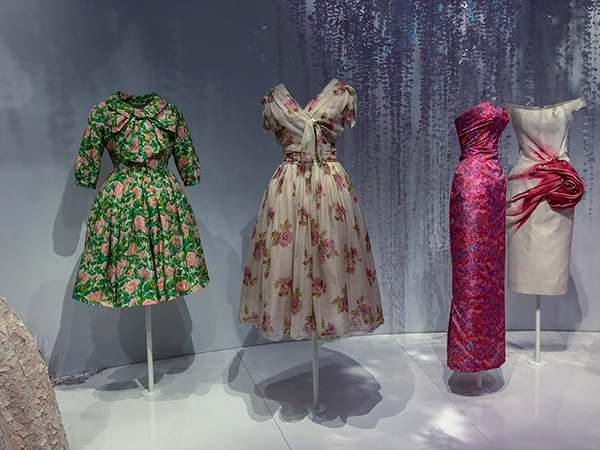
Locate an element on the screen. The image size is (600, 450). line on floor is located at coordinates (254, 385), (482, 432).